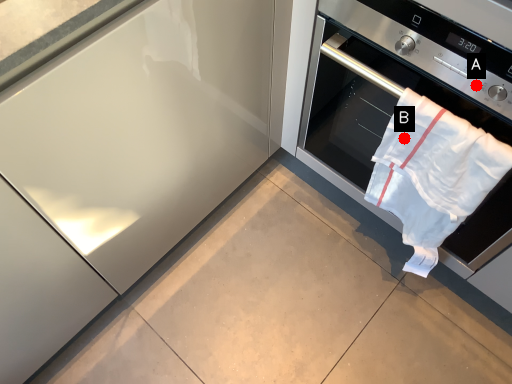
Question: Two points are circled on the image, labeled by A and B beside each circle. Which point is closer to the camera?

Choices:
 (A) A is closer
 (B) B is closer

Answer: (A)